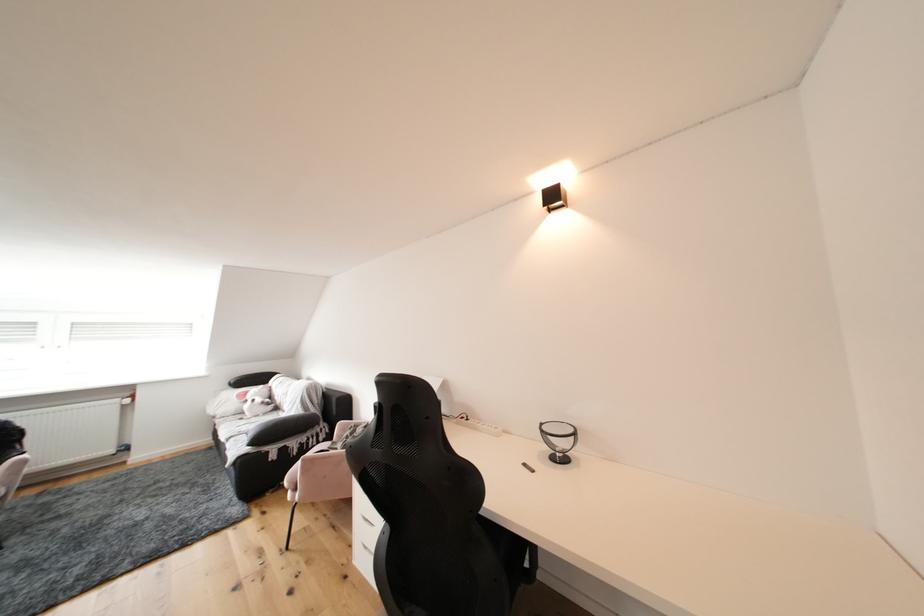
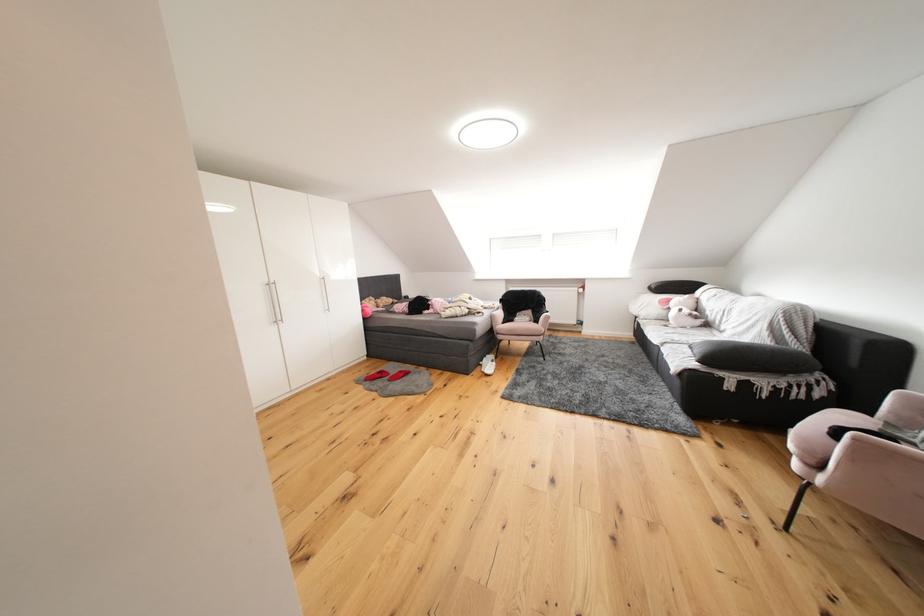
Find the pixel in the second image that matches pixel 261 438 in the first image.

(709, 354)